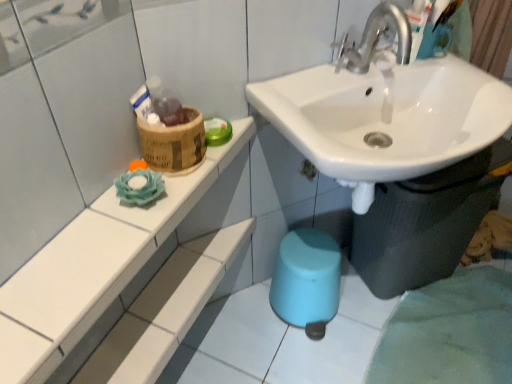
Question: Considering their positions, is white glossy sink at center located in front of or behind white ceramic shelf at upper left?

Choices:
 (A) behind
 (B) front

Answer: (A)

Question: Is white glossy sink at center spatially inside white ceramic shelf at upper left, or outside of it?

Choices:
 (A) outside
 (B) inside

Answer: (A)

Question: Based on their relative distances, which object is nearer to the white ceramic shelf at upper left?

Choices:
 (A) bamboo basket at upper left
 (B) white glossy sink at center

Answer: (A)

Question: Which is farther from the bamboo basket at upper left?

Choices:
 (A) white ceramic shelf at upper left
 (B) white glossy sink at center

Answer: (B)